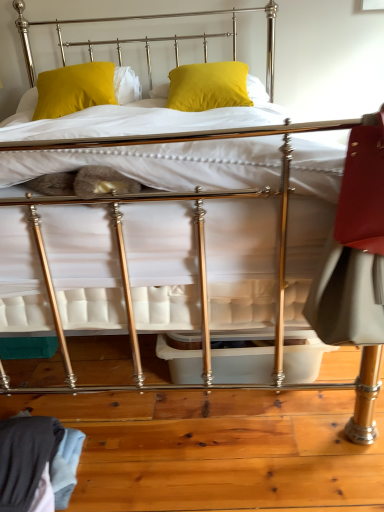
This screenshot has width=384, height=512. Find the location of `matte yellow pillow at center, which is the 1th pillow from right to left`. matte yellow pillow at center, which is the 1th pillow from right to left is located at coordinates (208, 86).

What do you see at coordinates (208, 86) in the screenshot? The height and width of the screenshot is (512, 384). I see `matte yellow pillow at center, the 2th pillow when ordered from left to right` at bounding box center [208, 86].

Describe the element at coordinates (74, 89) in the screenshot. I see `yellow matte pillow at upper center, which appears as the first pillow when viewed from the left` at that location.

At what (x,y) coordinates should I click in order to perform the action: click on yellow matte pillow at upper center, the second pillow viewed from the right. Please return your answer as a coordinate pair (x, y). Looking at the image, I should click on (74, 89).

The width and height of the screenshot is (384, 512). I want to click on matte yellow pillow at center, which is the 1th pillow from right to left, so click(208, 86).

From the picture: Considering the relative positions of yellow matte pillow at upper center, the second pillow viewed from the right, and matte yellow pillow at center, which is the 1th pillow from right to left, in the image provided, is yellow matte pillow at upper center, the second pillow viewed from the right, to the left of matte yellow pillow at center, which is the 1th pillow from right to left, from the viewer's perspective?

Indeed, yellow matte pillow at upper center, the second pillow viewed from the right, is positioned on the left side of matte yellow pillow at center, which is the 1th pillow from right to left.

Does yellow matte pillow at upper center, which appears as the first pillow when viewed from the left, come behind matte yellow pillow at center, the 2th pillow when ordered from left to right?

Yes, yellow matte pillow at upper center, which appears as the first pillow when viewed from the left, is behind matte yellow pillow at center, the 2th pillow when ordered from left to right.

Considering the positions of point (83, 69) and point (190, 93), is point (83, 69) closer or farther from the camera than point (190, 93)?

Point (83, 69) is farther from the camera than point (190, 93).

From the image's perspective, is yellow matte pillow at upper center, which appears as the first pillow when viewed from the left, above matte yellow pillow at center, the 2th pillow when ordered from left to right?

Actually, yellow matte pillow at upper center, which appears as the first pillow when viewed from the left, appears below matte yellow pillow at center, the 2th pillow when ordered from left to right, in the image.

From a real-world perspective, who is located higher, yellow matte pillow at upper center, the second pillow viewed from the right, or matte yellow pillow at center, the 2th pillow when ordered from left to right?

From a 3D spatial view, yellow matte pillow at upper center, the second pillow viewed from the right, is above.

Does yellow matte pillow at upper center, which appears as the first pillow when viewed from the left, have a greater width compared to matte yellow pillow at center, the 2th pillow when ordered from left to right?

No, yellow matte pillow at upper center, which appears as the first pillow when viewed from the left, is not wider than matte yellow pillow at center, the 2th pillow when ordered from left to right.

Does yellow matte pillow at upper center, the second pillow viewed from the right, have a lesser height compared to matte yellow pillow at center, which is the 1th pillow from right to left?

No, yellow matte pillow at upper center, the second pillow viewed from the right, is not shorter than matte yellow pillow at center, which is the 1th pillow from right to left.

Does yellow matte pillow at upper center, the second pillow viewed from the right, have a larger size compared to matte yellow pillow at center, which is the 1th pillow from right to left?

No, yellow matte pillow at upper center, the second pillow viewed from the right, is not bigger than matte yellow pillow at center, which is the 1th pillow from right to left.

Is yellow matte pillow at upper center, which appears as the first pillow when viewed from the left, located outside matte yellow pillow at center, the 2th pillow when ordered from left to right?

Indeed, yellow matte pillow at upper center, which appears as the first pillow when viewed from the left, is completely outside matte yellow pillow at center, the 2th pillow when ordered from left to right.

Is yellow matte pillow at upper center, the second pillow viewed from the right, directly adjacent to matte yellow pillow at center, the 2th pillow when ordered from left to right?

There is a gap between yellow matte pillow at upper center, the second pillow viewed from the right, and matte yellow pillow at center, the 2th pillow when ordered from left to right.

Is yellow matte pillow at upper center, which appears as the first pillow when viewed from the left, looking in the opposite direction of matte yellow pillow at center, the 2th pillow when ordered from left to right?

yellow matte pillow at upper center, which appears as the first pillow when viewed from the left, is not turned away from matte yellow pillow at center, the 2th pillow when ordered from left to right.

How distant is yellow matte pillow at upper center, the second pillow viewed from the right, from matte yellow pillow at center, the 2th pillow when ordered from left to right?

yellow matte pillow at upper center, the second pillow viewed from the right, is 19.52 inches from matte yellow pillow at center, the 2th pillow when ordered from left to right.

The image size is (384, 512). Identify the location of pillow located on the right of yellow matte pillow at upper center, which appears as the first pillow when viewed from the left. (208, 86).

Consider the image. Considering the positions of objects matte yellow pillow at center, which is the 1th pillow from right to left, and yellow matte pillow at upper center, the second pillow viewed from the right, in the image provided, who is more to the right, matte yellow pillow at center, which is the 1th pillow from right to left, or yellow matte pillow at upper center, the second pillow viewed from the right,?

Positioned to the right is matte yellow pillow at center, which is the 1th pillow from right to left.

Which object is closer to the camera, matte yellow pillow at center, the 2th pillow when ordered from left to right, or yellow matte pillow at upper center, which appears as the first pillow when viewed from the left?

matte yellow pillow at center, the 2th pillow when ordered from left to right.

Does point (228, 96) appear closer or farther from the camera than point (71, 95)?

Point (228, 96) is positioned closer to the camera compared to point (71, 95).

From the image's perspective, relative to yellow matte pillow at upper center, the second pillow viewed from the right, is matte yellow pillow at center, the 2th pillow when ordered from left to right, above or below?

From the image's perspective, matte yellow pillow at center, the 2th pillow when ordered from left to right, appears above yellow matte pillow at upper center, the second pillow viewed from the right.

From a real-world perspective, who is located lower, matte yellow pillow at center, the 2th pillow when ordered from left to right, or yellow matte pillow at upper center, which appears as the first pillow when viewed from the left?

matte yellow pillow at center, the 2th pillow when ordered from left to right, from a real-world perspective.

Is matte yellow pillow at center, the 2th pillow when ordered from left to right, wider than yellow matte pillow at upper center, the second pillow viewed from the right?

Yes, matte yellow pillow at center, the 2th pillow when ordered from left to right, is wider than yellow matte pillow at upper center, the second pillow viewed from the right.

In terms of height, does matte yellow pillow at center, which is the 1th pillow from right to left, look taller or shorter compared to yellow matte pillow at upper center, which appears as the first pillow when viewed from the left?

Clearly, matte yellow pillow at center, which is the 1th pillow from right to left, is shorter compared to yellow matte pillow at upper center, which appears as the first pillow when viewed from the left.

Based on their sizes in the image, would you say matte yellow pillow at center, the 2th pillow when ordered from left to right, is bigger or smaller than yellow matte pillow at upper center, the second pillow viewed from the right?

matte yellow pillow at center, the 2th pillow when ordered from left to right, is bigger than yellow matte pillow at upper center, the second pillow viewed from the right.

Is matte yellow pillow at center, which is the 1th pillow from right to left, inside the boundaries of yellow matte pillow at upper center, which appears as the first pillow when viewed from the left, or outside?

matte yellow pillow at center, which is the 1th pillow from right to left, is not inside yellow matte pillow at upper center, which appears as the first pillow when viewed from the left, it's outside.

Are matte yellow pillow at center, the 2th pillow when ordered from left to right, and yellow matte pillow at upper center, the second pillow viewed from the right, making contact?

matte yellow pillow at center, the 2th pillow when ordered from left to right, and yellow matte pillow at upper center, the second pillow viewed from the right, are not in contact.

Is matte yellow pillow at center, the 2th pillow when ordered from left to right, oriented away from yellow matte pillow at upper center, the second pillow viewed from the right?

No, matte yellow pillow at center, the 2th pillow when ordered from left to right, is not facing the opposite direction of yellow matte pillow at upper center, the second pillow viewed from the right.

This screenshot has height=512, width=384. Find the location of `pillow on the right of yellow matte pillow at upper center, which appears as the first pillow when viewed from the left`. pillow on the right of yellow matte pillow at upper center, which appears as the first pillow when viewed from the left is located at coordinates (208, 86).

The height and width of the screenshot is (512, 384). In the image, there is a yellow matte pillow at upper center, which appears as the first pillow when viewed from the left. What are the coordinates of `pillow below it (from a real-world perspective)` in the screenshot? It's located at (208, 86).

I want to click on pillow in front of the yellow matte pillow at upper center, which appears as the first pillow when viewed from the left, so click(x=208, y=86).